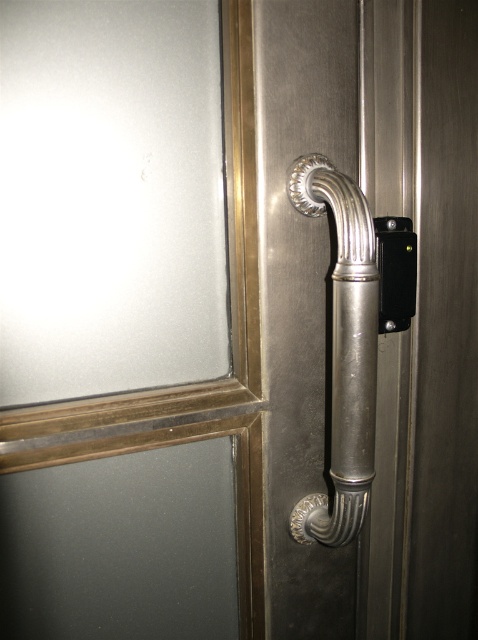
You are trying to determine the spatial relationship between the frosted glass screen door at upper left and the polished silver handle at right. Based on their positions, which object is wider?

The frosted glass screen door at upper left might be wider than polished silver handle at right.

You are standing in front of the door and want to reach a point that is exactly at coordinate point (238,570). Your hand can extend up to 30 inches. Can you reach that point without moving your feet?

The distance of point (238,570) from camera is 32.69 inches, so you cannot reach it with your hand extended up to 30 inches without moving your feet.

You are standing in front of the door and want to locate the polished silver handle at right. Can you tell me its exact position coordinates?

The polished silver handle at right is located at coordinates point (344, 353).